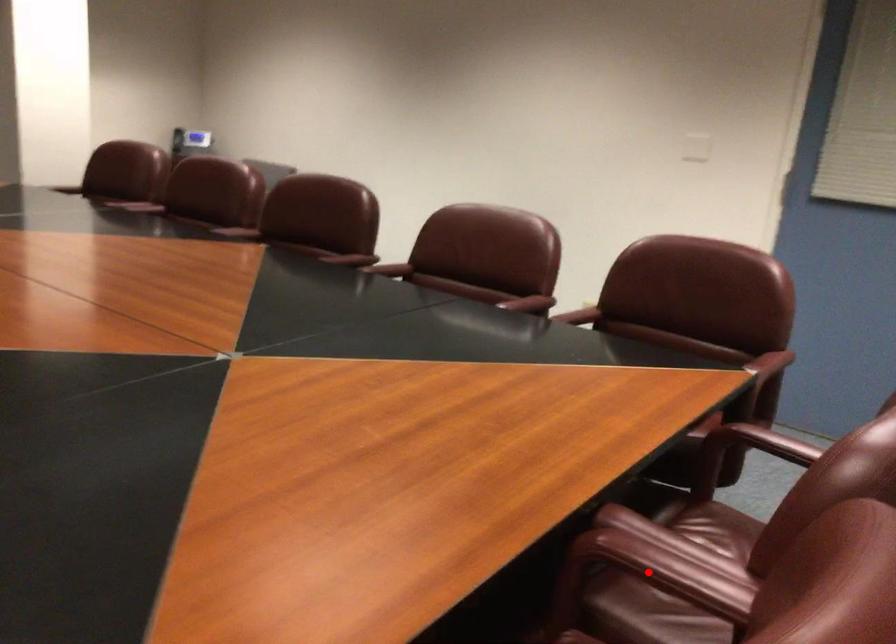
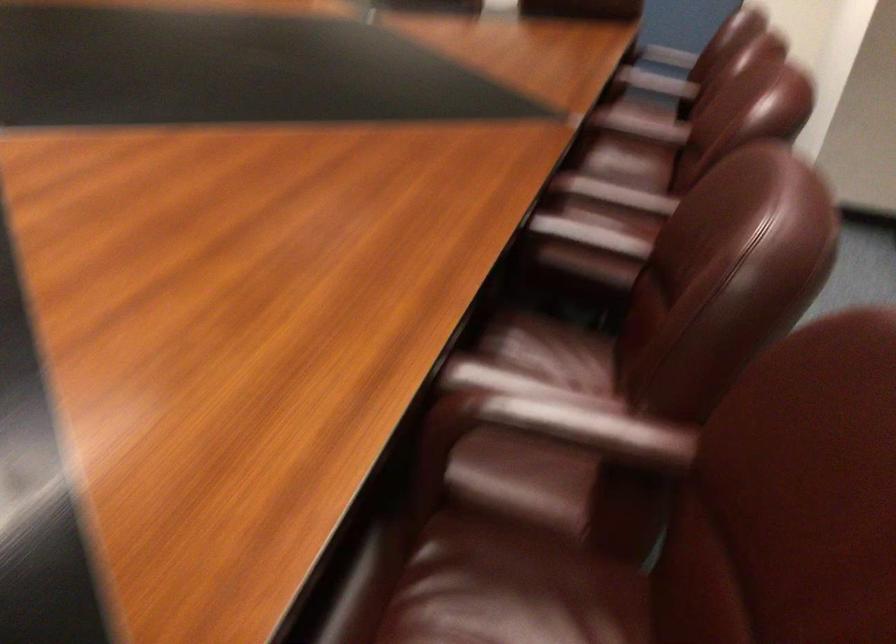
Question: I am providing you with two images of the same scene from different viewpoints. Given a red point in image1, look at the same physical point in image2. Is it:

Choices:
 (A) Closer to the viewpoint
 (B) Farther from the viewpoint

Answer: (B)